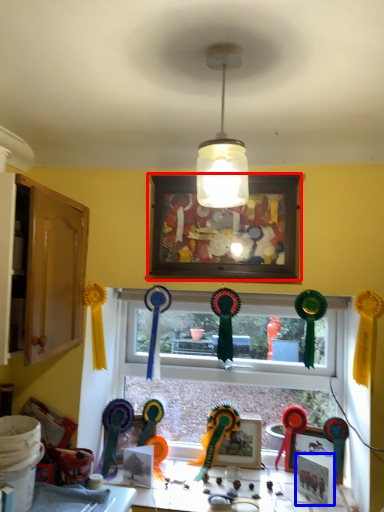
Question: Which point is further to the camera, picture frame (highlighted by a red box) or picture frame (highlighted by a blue box)?

Choices:
 (A) picture frame
 (B) picture frame

Answer: (B)